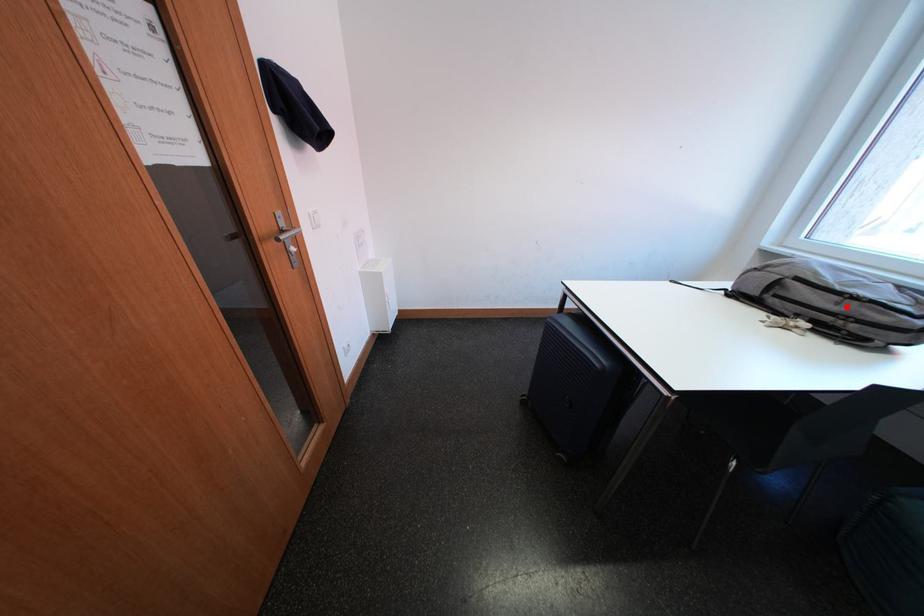
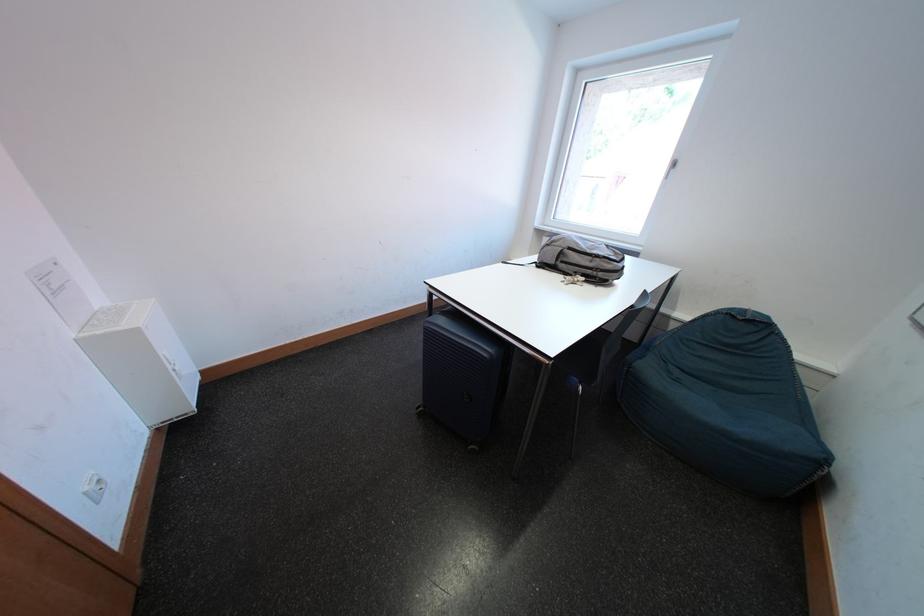
Question: I am providing you with two images of the same scene from different viewpoints. Given a red point in image1, look at the same physical point in image2. Is it:

Choices:
 (A) Closer to the viewpoint
 (B) Farther from the viewpoint

Answer: (A)